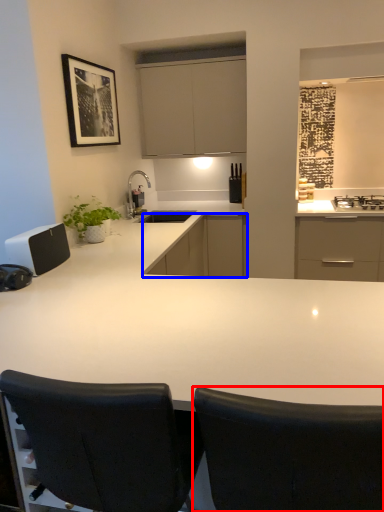
Question: Which object appears farthest to the camera in this image, chair (highlighted by a red box) or cabinetry (highlighted by a blue box)?

Choices:
 (A) chair
 (B) cabinetry

Answer: (B)